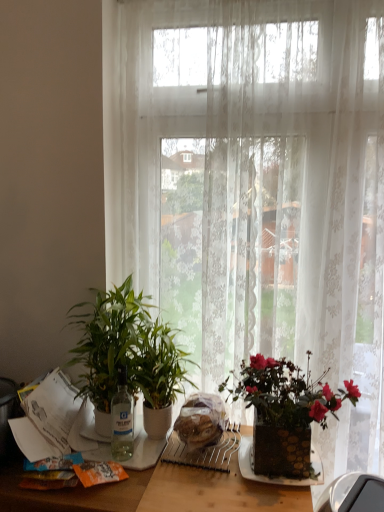
I want to click on space that is in front of translucent plastic bread at center, so click(199, 481).